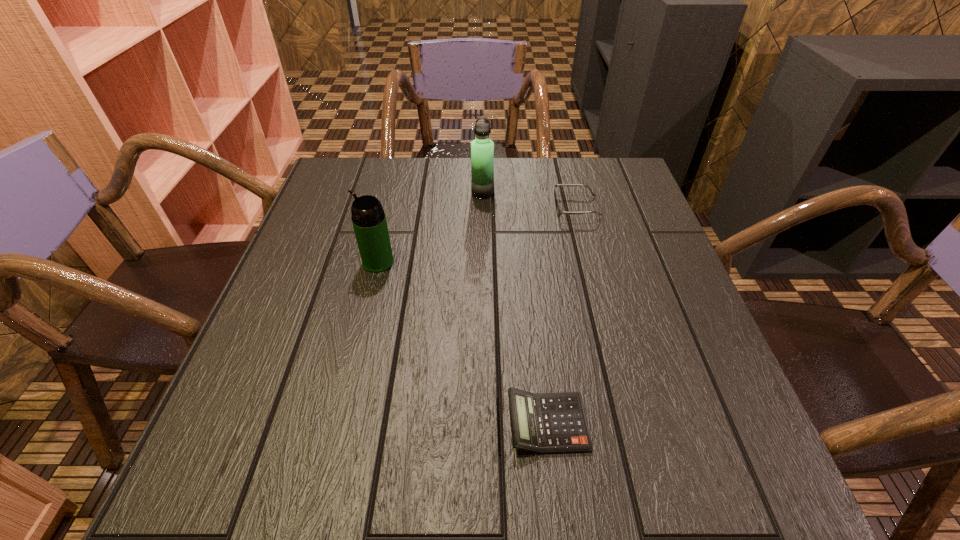
The image size is (960, 540). I want to click on the right thermos bottle, so click(x=482, y=148).

The height and width of the screenshot is (540, 960). Identify the location of the farther thermos bottle. (482, 148).

The image size is (960, 540). Find the location of `the nearer thermos bottle`. the nearer thermos bottle is located at coordinates 369,222.

The image size is (960, 540). In order to click on the third farthest object in this screenshot , I will do `click(369, 222)`.

Locate an element on the screen. the rightmost object is located at coordinates (559, 211).

Where is `the nearest object`? The image size is (960, 540). the nearest object is located at coordinates (545, 423).

This screenshot has height=540, width=960. I want to click on the second object from right to left, so click(545, 423).

Locate an element on the screen. The image size is (960, 540). blank space located 0.110m on the back of the second object from left to right is located at coordinates (482, 166).

I want to click on vacant space located 0.140m from the spout of the leftmost object, so click(300, 262).

Locate an element on the screen. blank space located 0.100m from the spout of the leftmost object is located at coordinates (319, 262).